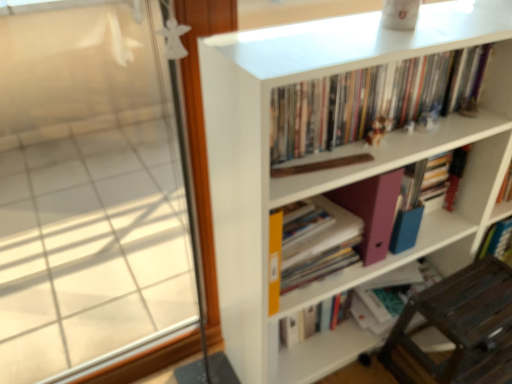
Question: Can you confirm if yellow matte folder at center, which is the third book from top to bottom, is thinner than white matte bookcase at upper right?

Choices:
 (A) yes
 (B) no

Answer: (A)

Question: From the image's perspective, is yellow matte folder at center, which is the third book from top to bottom, above white matte bookcase at upper right?

Choices:
 (A) yes
 (B) no

Answer: (B)

Question: From a real-world perspective, is yellow matte folder at center, which is the third book from top to bottom, positioned under white matte bookcase at upper right based on gravity?

Choices:
 (A) yes
 (B) no

Answer: (A)

Question: Is yellow matte folder at center, marked as the 2th book in a bottom-to-top arrangement, positioned before white matte bookcase at upper right?

Choices:
 (A) no
 (B) yes

Answer: (A)

Question: Can white matte bookcase at upper right be found inside yellow matte folder at center, marked as the 2th book in a bottom-to-top arrangement?

Choices:
 (A) yes
 (B) no

Answer: (B)

Question: From a real-world perspective, relative to hardcover book at center, which is counted as the second book, starting from the top, is transparent glass window at left vertically above or below?

Choices:
 (A) above
 (B) below

Answer: (A)

Question: Is transparent glass window at left inside or outside of hardcover book at center, the 3th book when ordered from bottom to top?

Choices:
 (A) inside
 (B) outside

Answer: (B)

Question: Looking at their shapes, would you say transparent glass window at left is wider or thinner than hardcover book at center, which is counted as the second book, starting from the top?

Choices:
 (A) thin
 (B) wide

Answer: (B)

Question: Does point (54, 61) appear closer or farther from the camera than point (444, 198)?

Choices:
 (A) farther
 (B) closer

Answer: (A)

Question: Is brown wooden chair at lower right situated inside hardcover books at upper center, which is the 1th book in top-to-bottom order, or outside?

Choices:
 (A) inside
 (B) outside

Answer: (B)

Question: Considering the relative positions of brown wooden chair at lower right and hardcover books at upper center, which is the 1th book in top-to-bottom order, in the image provided, is brown wooden chair at lower right to the left or to the right of hardcover books at upper center, which is the 1th book in top-to-bottom order,?

Choices:
 (A) left
 (B) right

Answer: (B)

Question: Considering the positions of brown wooden chair at lower right and hardcover books at upper center, which is the 1th book in top-to-bottom order, in the image, is brown wooden chair at lower right wider or thinner than hardcover books at upper center, which is the 1th book in top-to-bottom order,?

Choices:
 (A) thin
 (B) wide

Answer: (B)

Question: Is brown wooden chair at lower right bigger or smaller than hardcover books at upper center, the 4th book ordered from the bottom?

Choices:
 (A) small
 (B) big

Answer: (B)

Question: From the image's perspective, is matte pink folder at center located above or below matte pink folder at lower center, which is counted as the 4th book, starting from the top?

Choices:
 (A) below
 (B) above

Answer: (B)

Question: Is point pyautogui.click(x=384, y=188) closer or farther from the camera than point pyautogui.click(x=386, y=286)?

Choices:
 (A) farther
 (B) closer

Answer: (B)